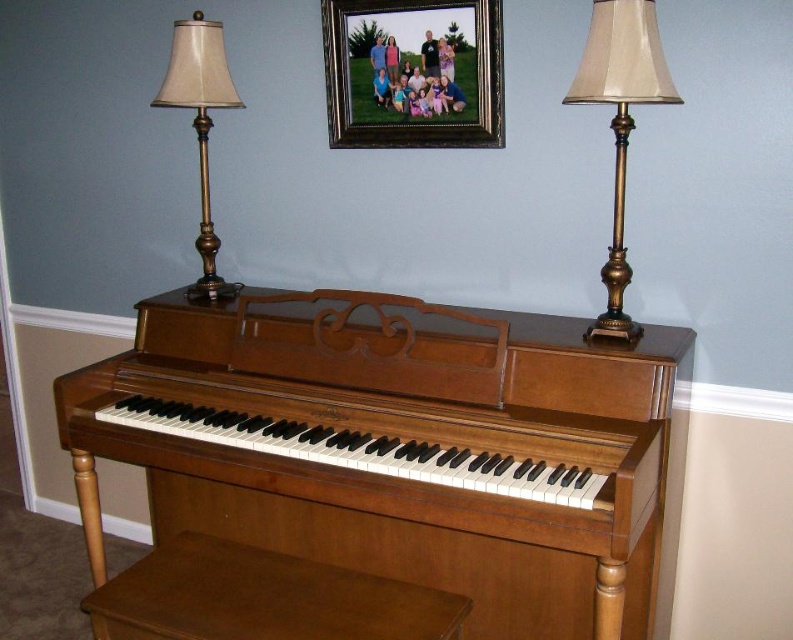
You are a piano teacher who needs to adjust the distance between the wooden piano at center and the gold metallic lampshade at left to 30 inches for proper lighting. Based on the current setup, should you move the lamp closer or farther away from the piano?

The wooden piano at center and gold metallic lampshade at left are currently 29.58 inches apart. To reach the desired 30 inches, you should move the gold metallic lampshade at left slightly farther away from the wooden piano at center.

You are a furniture delivery person who needs to move the wooden piano at center and the gold metallic table lamp at right through a narrow doorway. The doorway is just wide enough to fit the larger of the two items. Which item should you move first?

The wooden piano at center is larger in size than the gold metallic table lamp at right, so you should move the wooden piano at center first since it requires more space and the doorway can accommodate its width.

You are standing in the room and want to move from the gold metallic lampshade at left to the wooden piano at center. Which direction should you move relative to the lampshade?

You should move to the right relative to the gold metallic lampshade at left to reach the wooden piano at center, since the wooden piano at center is positioned to the right of the gold metallic lampshade at left.